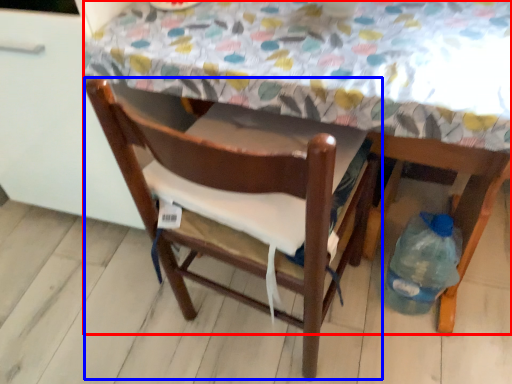
Question: Among these objects, which one is nearest to the camera, table (highlighted by a red box) or chair (highlighted by a blue box)?

Choices:
 (A) table
 (B) chair

Answer: (A)